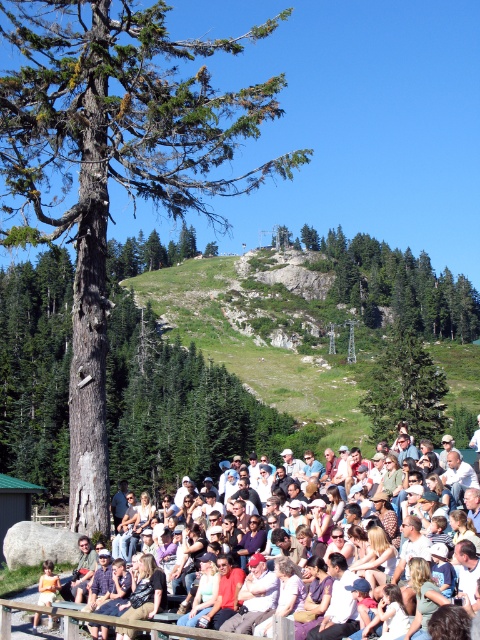
Question: Which point is farther to the camera?

Choices:
 (A) (400, 397)
 (B) (452, 620)
 (C) (57, 28)
 (D) (416, 289)

Answer: (D)

Question: Which object is the farthest from the dark brown bark tree at left?

Choices:
 (A) green textured rock at upper center
 (B) green matte tree at center

Answer: (A)

Question: Estimate the real-world distances between objects in this image. Which object is closer to the green matte tree at center?

Choices:
 (A) light brown wooden bench at center
 (B) green textured rock at upper center

Answer: (B)

Question: Can you confirm if dark brown bark tree at left is smaller than light brown wooden bench at center?

Choices:
 (A) no
 (B) yes

Answer: (A)

Question: Is green matte tree at center positioned in front of light brown wooden bench at center?

Choices:
 (A) no
 (B) yes

Answer: (A)

Question: Can you confirm if green textured rock at upper center is positioned to the left of green matte tree at center?

Choices:
 (A) no
 (B) yes

Answer: (A)